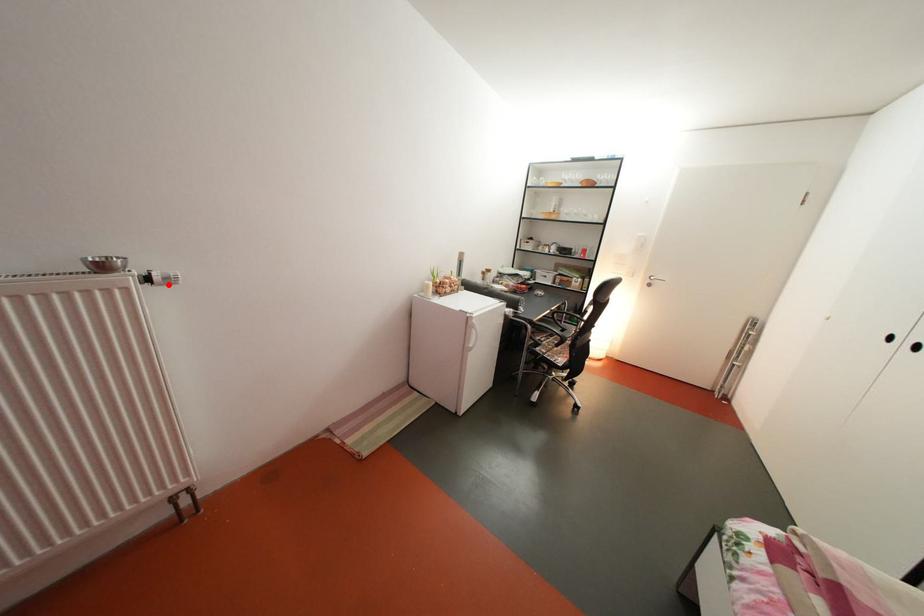
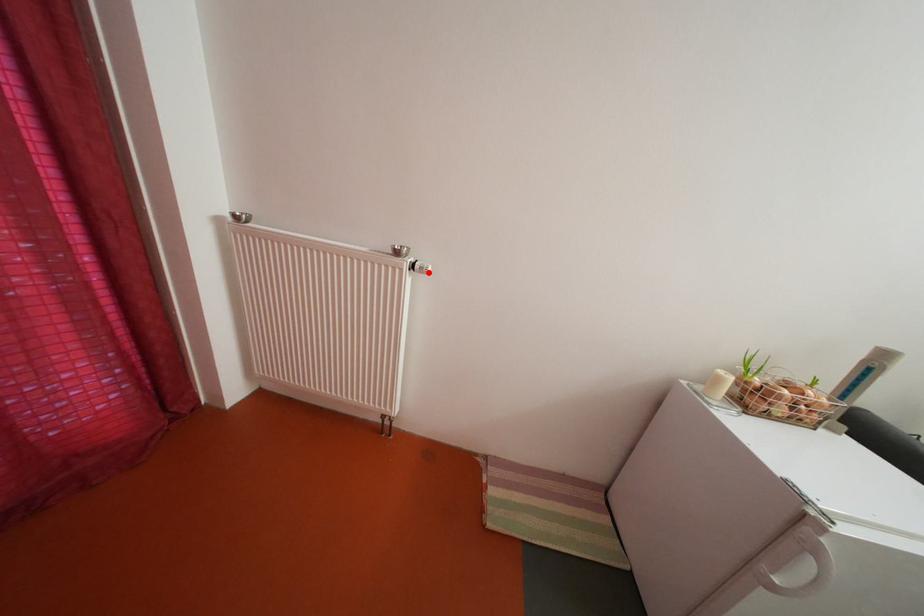
I am providing you with two images of the same scene from different viewpoints. A red point is marked on the first image and another point is marked on the second image. Do the highlighted points in image1 and image2 indicate the same real-world spot?

Yes